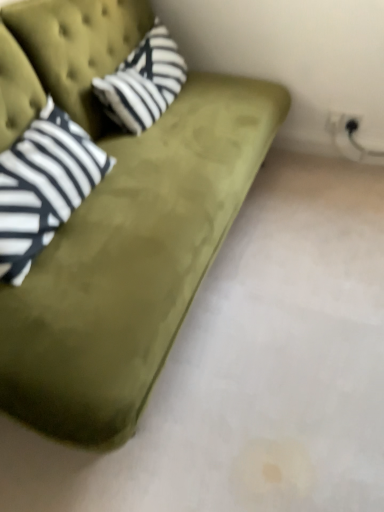
Question: Does striped cotton pillow at upper left have a lesser height compared to olive green velvet couch at upper left?

Choices:
 (A) yes
 (B) no

Answer: (A)

Question: Can we say striped cotton pillow at upper left lies outside olive green velvet couch at upper left?

Choices:
 (A) no
 (B) yes

Answer: (A)

Question: Does striped cotton pillow at upper left appear on the right side of olive green velvet couch at upper left?

Choices:
 (A) no
 (B) yes

Answer: (B)

Question: Considering the relative sizes of striped cotton pillow at upper left and olive green velvet couch at upper left in the image provided, is striped cotton pillow at upper left wider than olive green velvet couch at upper left?

Choices:
 (A) yes
 (B) no

Answer: (B)

Question: Can you confirm if striped cotton pillow at upper left is taller than olive green velvet couch at upper left?

Choices:
 (A) no
 (B) yes

Answer: (A)

Question: Is striped cotton pillow at upper left placed right next to olive green velvet couch at upper left?

Choices:
 (A) no
 (B) yes

Answer: (A)

Question: Is striped fabric pillow at left to the left of olive green velvet couch at upper left from the viewer's perspective?

Choices:
 (A) yes
 (B) no

Answer: (A)

Question: Is striped fabric pillow at left to the right of olive green velvet couch at upper left from the viewer's perspective?

Choices:
 (A) no
 (B) yes

Answer: (A)

Question: Does striped fabric pillow at left have a greater height compared to olive green velvet couch at upper left?

Choices:
 (A) no
 (B) yes

Answer: (A)

Question: Considering the relative sizes of striped fabric pillow at left and olive green velvet couch at upper left in the image provided, is striped fabric pillow at left shorter than olive green velvet couch at upper left?

Choices:
 (A) no
 (B) yes

Answer: (B)

Question: From a real-world perspective, is striped fabric pillow at left positioned over olive green velvet couch at upper left based on gravity?

Choices:
 (A) yes
 (B) no

Answer: (A)

Question: Considering the relative sizes of striped fabric pillow at left and olive green velvet couch at upper left in the image provided, is striped fabric pillow at left bigger than olive green velvet couch at upper left?

Choices:
 (A) yes
 (B) no

Answer: (B)

Question: From a real-world perspective, is olive green velvet couch at upper left located higher than striped cotton pillow at upper left?

Choices:
 (A) no
 (B) yes

Answer: (A)